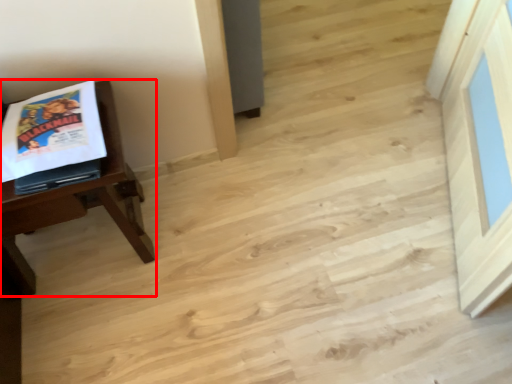
Question: From the image's perspective, what is the correct spatial positioning of table (annotated by the red box) in reference to comic book?

Choices:
 (A) above
 (B) below

Answer: (B)